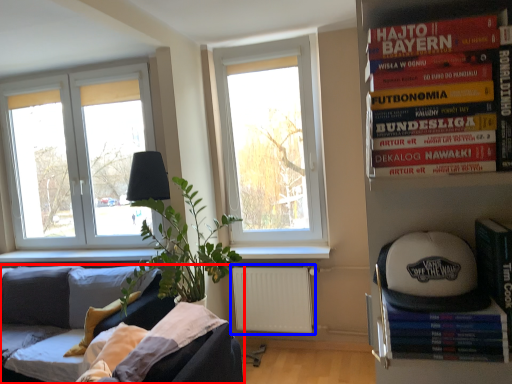
Question: Which point is closer to the camera, studio couch (highlighted by a red box) or radiator (highlighted by a blue box)?

Choices:
 (A) studio couch
 (B) radiator

Answer: (A)